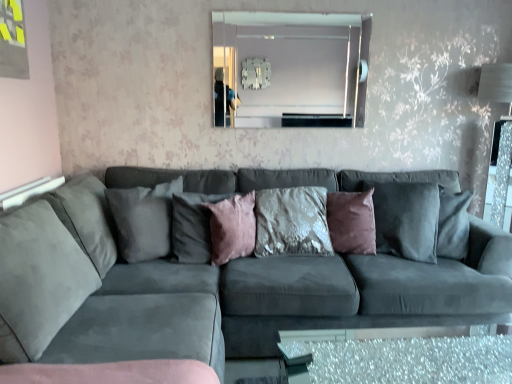
Describe the element at coordinates (232, 228) in the screenshot. The height and width of the screenshot is (384, 512). I see `pink velvet cushion at center, the 3th pillow viewed from the left` at that location.

This screenshot has width=512, height=384. Identify the location of pink velvet pillow at center, arranged as the 2th pillow when viewed from the left. (193, 226).

This screenshot has width=512, height=384. In order to click on clear glass mirror at upper center in this screenshot , I will do `click(287, 68)`.

The image size is (512, 384). In order to click on velvet textured pillow at center, placed as the first pillow when sorted from right to left in this screenshot , I will do `click(352, 222)`.

The image size is (512, 384). What do you see at coordinates (210, 282) in the screenshot?
I see `suede gray couch at center` at bounding box center [210, 282].

Image resolution: width=512 pixels, height=384 pixels. What are the coordinates of `clear glass table at lower center` in the screenshot? It's located at (391, 356).

Starting from the suede gray pillow at center, placed as the first pillow when sorted from left to right, which pillow is the 1st one behind? Please provide its 2D coordinates.

[(232, 228)]

Can you confirm if suede gray pillow at center, placed as the first pillow when sorted from left to right, is taller than pink velvet cushion at center, the 3th pillow viewed from the left?

Indeed, suede gray pillow at center, placed as the first pillow when sorted from left to right, has a greater height compared to pink velvet cushion at center, the 3th pillow viewed from the left.

Which object is closer to the camera, suede gray pillow at center, positioned as the fourth pillow in right-to-left order, or pink velvet cushion at center, the 3th pillow viewed from the left?

suede gray pillow at center, positioned as the fourth pillow in right-to-left order, is in front.

Between point (118, 205) and point (243, 247), which one is positioned in front?

The point (118, 205) is more forward.

From the image's perspective, which one is positioned lower, suede gray couch at center or clear glass table at lower center?

clear glass table at lower center.

How far apart are suede gray couch at center and clear glass table at lower center?

They are 67.70 centimeters apart.

Does suede gray couch at center have a smaller size compared to clear glass table at lower center?

Actually, suede gray couch at center might be larger than clear glass table at lower center.

Is suede gray couch at center further to the viewer compared to clear glass table at lower center?

No, it is in front of clear glass table at lower center.

Would you say suede gray couch at center contains pink velvet pillow at center, arranged as the 2th pillow when viewed from the left?

Indeed, pink velvet pillow at center, arranged as the 2th pillow when viewed from the left, is located within suede gray couch at center.

Are suede gray couch at center and pink velvet pillow at center, the 3th pillow viewed from the right, beside each other?

No, suede gray couch at center is not with pink velvet pillow at center, the 3th pillow viewed from the right.

What's the angular difference between suede gray couch at center and pink velvet pillow at center, arranged as the 2th pillow when viewed from the left,'s facing directions?

suede gray couch at center and pink velvet pillow at center, arranged as the 2th pillow when viewed from the left, are facing 29.9 degrees away from each other.

Between suede gray couch at center and pink velvet pillow at center, arranged as the 2th pillow when viewed from the left, which one has larger width?

Wider between the two is suede gray couch at center.

Is clear glass table at lower center to the left or to the right of clear glass mirror at upper center in the image?

Clearly, clear glass table at lower center is on the right of clear glass mirror at upper center in the image.

Between clear glass table at lower center and clear glass mirror at upper center, which one has smaller width?

clear glass mirror at upper center is thinner.

Is clear glass mirror at upper center surrounded by clear glass table at lower center?

No, clear glass mirror at upper center is located outside of clear glass table at lower center.

How many degrees apart are the facing directions of clear glass mirror at upper center and pink velvet cushion at center, the second pillow viewed from the right?

They differ by 46.4 degrees in their facing directions.

Looking at this image, from a real-world perspective, which is physically above, clear glass mirror at upper center or pink velvet cushion at center, the second pillow viewed from the right?

From a 3D spatial view, clear glass mirror at upper center is above.

Considering the relative sizes of clear glass mirror at upper center and pink velvet cushion at center, the 3th pillow viewed from the left, in the image provided, is clear glass mirror at upper center wider than pink velvet cushion at center, the 3th pillow viewed from the left,?

No.

Is clear glass mirror at upper center smaller than pink velvet cushion at center, the 3th pillow viewed from the left?

Incorrect, clear glass mirror at upper center is not smaller in size than pink velvet cushion at center, the 3th pillow viewed from the left.

Based on the photo, from the image's perspective, which one is positioned higher, velvet textured pillow at center, placed as the first pillow when sorted from right to left, or clear glass table at lower center?

velvet textured pillow at center, placed as the first pillow when sorted from right to left, is shown above in the image.

In terms of width, does velvet textured pillow at center, placed as the first pillow when sorted from right to left, look wider or thinner when compared to clear glass table at lower center?

Clearly, velvet textured pillow at center, placed as the first pillow when sorted from right to left, has less width compared to clear glass table at lower center.

Could you tell me if velvet textured pillow at center, the fourth pillow positioned from the left, is facing clear glass table at lower center?

Yes, velvet textured pillow at center, the fourth pillow positioned from the left, is oriented towards clear glass table at lower center.

Looking at the image, does velvet textured pillow at center, the fourth pillow positioned from the left, seem bigger or smaller compared to clear glass table at lower center?

Clearly, velvet textured pillow at center, the fourth pillow positioned from the left, is smaller in size than clear glass table at lower center.

Between velvet textured pillow at center, the fourth pillow positioned from the left, and suede gray couch at center, which one has less height?

With less height is velvet textured pillow at center, the fourth pillow positioned from the left.

Considering the relative positions of velvet textured pillow at center, the fourth pillow positioned from the left, and suede gray couch at center in the image provided, is velvet textured pillow at center, the fourth pillow positioned from the left, to the left of suede gray couch at center from the viewer's perspective?

No.

The width and height of the screenshot is (512, 384). I want to click on studio couch in front of the velvet textured pillow at center, placed as the first pillow when sorted from right to left, so click(x=210, y=282).

In order to click on the 3rd pillow positioned above the pink velvet cushion at center, the second pillow viewed from the right (from the image's perspective) in this screenshot , I will do `click(143, 219)`.

Locate an element on the screen. glass table behind the suede gray couch at center is located at coordinates (391, 356).

Looking at the image, which one is located further to pink velvet cushion at center, the second pillow viewed from the right, clear glass mirror at upper center or suede gray pillow at center, placed as the first pillow when sorted from left to right?

Among the two, clear glass mirror at upper center is located further to pink velvet cushion at center, the second pillow viewed from the right.

From the picture: Which object lies further to the anchor point suede gray couch at center, pink velvet pillow at center, arranged as the 2th pillow when viewed from the left, or velvet textured pillow at center, the fourth pillow positioned from the left?

Among the two, velvet textured pillow at center, the fourth pillow positioned from the left, is located further to suede gray couch at center.

Looking at the image, which one is located closer to clear glass mirror at upper center, pink velvet pillow at center, arranged as the 2th pillow when viewed from the left, or pink velvet cushion at center, the 3th pillow viewed from the left?

Based on the image, pink velvet cushion at center, the 3th pillow viewed from the left, appears to be nearer to clear glass mirror at upper center.

Considering their positions, is suede gray couch at center positioned further to clear glass mirror at upper center than clear glass table at lower center?

The object further to clear glass mirror at upper center is clear glass table at lower center.

Estimate the real-world distances between objects in this image. Which object is further from clear glass table at lower center, velvet textured pillow at center, the fourth pillow positioned from the left, or suede gray couch at center?

Based on the image, velvet textured pillow at center, the fourth pillow positioned from the left, appears to be further to clear glass table at lower center.

Which object lies further to the anchor point pink velvet pillow at center, arranged as the 2th pillow when viewed from the left, velvet textured pillow at center, the fourth pillow positioned from the left, or pink velvet cushion at center, the second pillow viewed from the right?

The object further to pink velvet pillow at center, arranged as the 2th pillow when viewed from the left, is velvet textured pillow at center, the fourth pillow positioned from the left.

Which object lies further to the anchor point suede gray pillow at center, placed as the first pillow when sorted from left to right, suede gray couch at center or clear glass table at lower center?

clear glass table at lower center is positioned further to the anchor suede gray pillow at center, placed as the first pillow when sorted from left to right.

Which object lies nearer to the anchor point clear glass table at lower center, clear glass mirror at upper center or pink velvet pillow at center, arranged as the 2th pillow when viewed from the left?

Based on the image, pink velvet pillow at center, arranged as the 2th pillow when viewed from the left, appears to be nearer to clear glass table at lower center.

Where is `pillow between suede gray pillow at center, placed as the first pillow when sorted from left to right, and pink velvet cushion at center, the second pillow viewed from the right`? The image size is (512, 384). pillow between suede gray pillow at center, placed as the first pillow when sorted from left to right, and pink velvet cushion at center, the second pillow viewed from the right is located at coordinates (193, 226).

What are the coordinates of `glass table located between suede gray couch at center and velvet textured pillow at center, placed as the first pillow when sorted from right to left, in the depth direction` in the screenshot? It's located at (391, 356).

At what (x,y) coordinates should I click in order to perform the action: click on mirror situated between suede gray pillow at center, positioned as the fourth pillow in right-to-left order, and velvet textured pillow at center, placed as the first pillow when sorted from right to left, from left to right. Please return your answer as a coordinate pair (x, y). Looking at the image, I should click on (287, 68).

Identify the location of pillow between pink velvet pillow at center, the 3th pillow viewed from the right, and velvet textured pillow at center, the fourth pillow positioned from the left, from left to right. (232, 228).